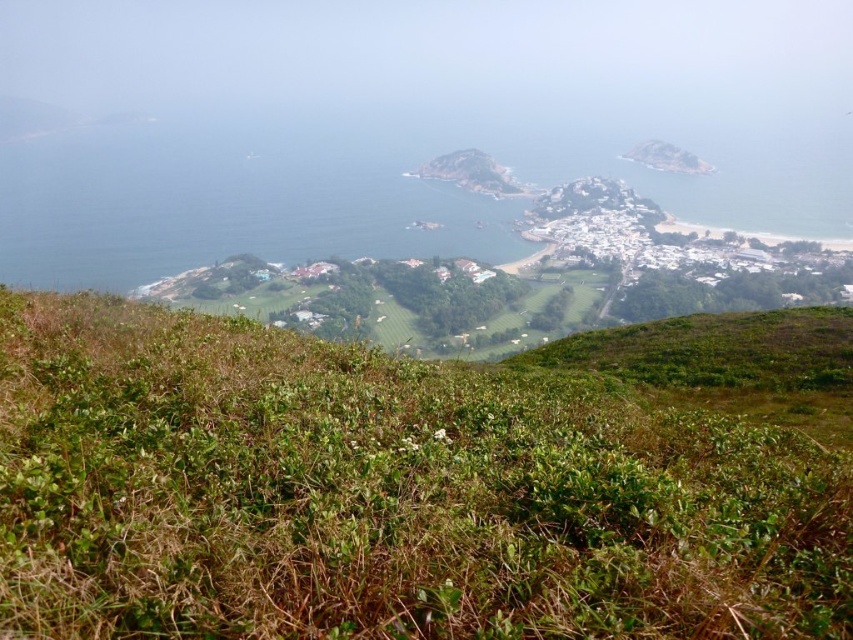
You are a landscape architect designing a garden and need to place both the green leafy shrubs at center and the rugged brown rock at center in a narrow pathway. Which object should you place first to ensure they both fit without overlapping?

The green leafy shrubs at center should be placed first since their width is less than the rugged brown rock at center, allowing more space for the wider rock afterward.

You are a hiker standing at the edge of the lush greenery in the foreground. You see the blue water at center and the rugged brown rock at center. Which object appears taller from your vantage point?

The blue water at center appears taller than the rugged brown rock at center from your vantage point.